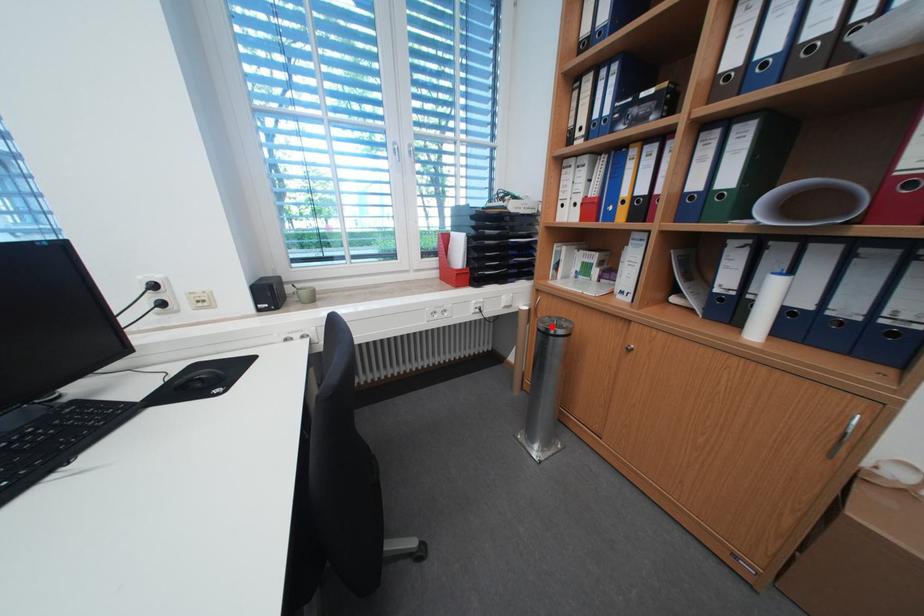
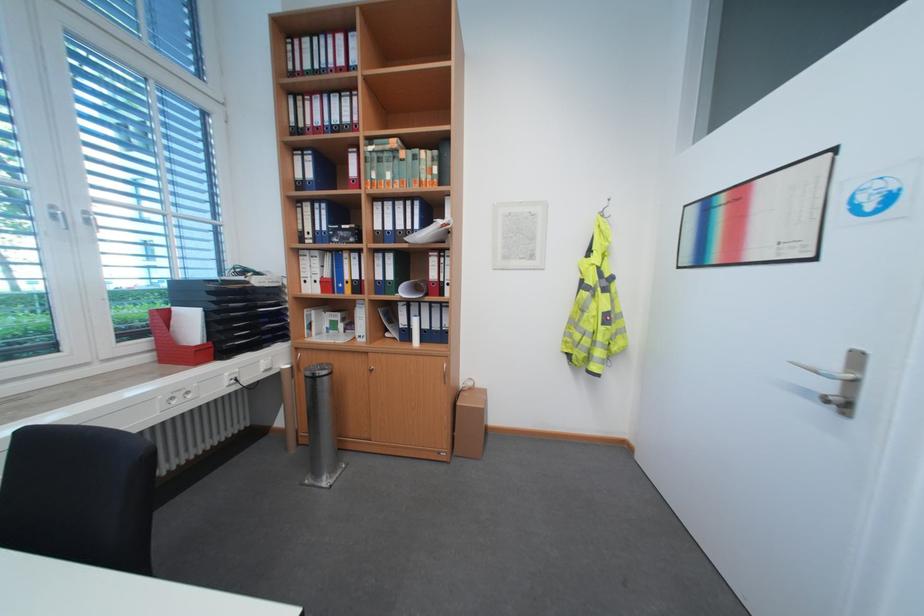
Question: I am providing you with two images of the same scene from different viewpoints. Image1 has a red point marked. In image2, the corresponding 3D location appears at what relative position? Reply with the corresponding letter.

Choices:
 (A) Closer
 (B) Farther

Answer: (B)